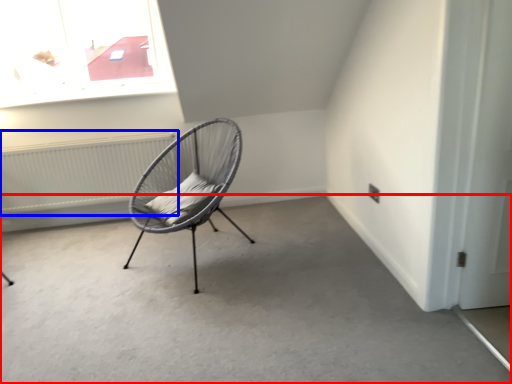
Question: Among these objects, which one is farthest to the camera, concrete (highlighted by a red box) or radiator (highlighted by a blue box)?

Choices:
 (A) concrete
 (B) radiator

Answer: (B)